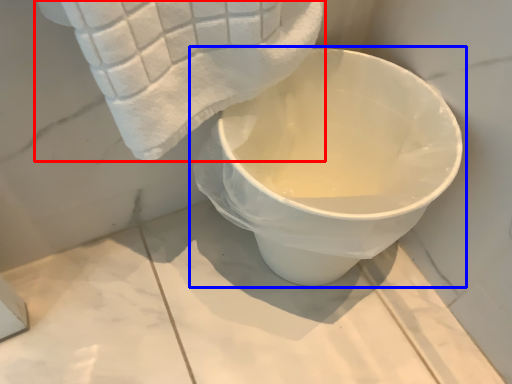
Question: Which of the following is the farthest to the observer, towel (highlighted by a red box) or toilet (highlighted by a blue box)?

Choices:
 (A) towel
 (B) toilet

Answer: (B)